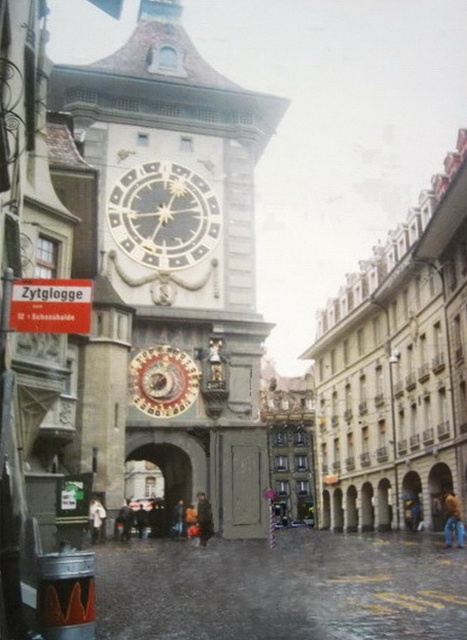
You are standing at the base of the Zytglogge clock tower in Bern, Switzerland. You want to take a photo of the clock face and the smaller circular clock below it. There is a specific point at coordinates point [255,460] that you need to include in your photo. Considering the distance of this point from you, will you need to zoom in or zoom out to ensure both the main clock face and the smaller clock are visible in the frame?

The distance of point [255,460] from viewer is 61.88 meters. Since the point is relatively far away, you will need to zoom out to ensure both the main clock face and the smaller circular clock below it are visible in the frame.

You are a tourist standing in front of the historic Zytglogge clock tower in Bern, Switzerland. You notice the stone clock tower at center and the dark gray metal clock at center. Which of these two objects is bigger?

The stone clock tower at center is larger in size than the dark gray metal clock at center, so the stone clock tower at center is bigger.

You are standing in front of the historic Zytglogge clock tower in Bern, Switzerland. You want to take a photo that includes both the stone clock tower at center and the dark gray metal clock at center. If your camera has a maximum focus range of 5 meters, will you be able to capture both objects in the same frame without moving closer?

The stone clock tower at center is 5.28 meters away from the dark gray metal clock at center. Since the distance between them exceeds the camera maximum focus range of 5 meters, you will not be able to capture both objects in the same frame without moving closer.